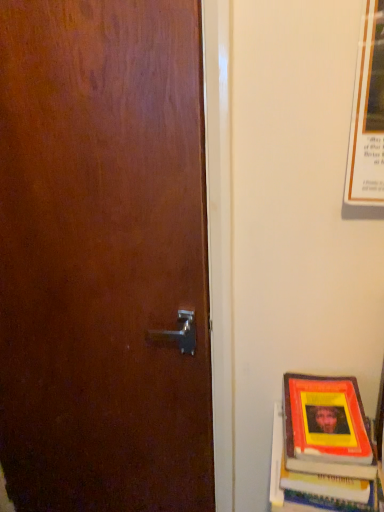
Question: Is matte paper poster at upper right spatially inside yellow matte book at lower right, or outside of it?

Choices:
 (A) inside
 (B) outside

Answer: (B)

Question: From a real-world perspective, is matte paper poster at upper right positioned above or below yellow matte book at lower right?

Choices:
 (A) below
 (B) above

Answer: (B)

Question: From the image's perspective, relative to yellow matte book at lower right, is matte paper poster at upper right above or below?

Choices:
 (A) above
 (B) below

Answer: (A)

Question: From the image's perspective, is yellow matte book at lower right positioned above or below matte paper poster at upper right?

Choices:
 (A) above
 (B) below

Answer: (B)

Question: Is yellow matte book at lower right spatially inside matte paper poster at upper right, or outside of it?

Choices:
 (A) outside
 (B) inside

Answer: (A)

Question: Based on their positions, is yellow matte book at lower right located to the left or right of matte paper poster at upper right?

Choices:
 (A) left
 (B) right

Answer: (A)

Question: From their relative heights in the image, would you say yellow matte book at lower right is taller or shorter than matte paper poster at upper right?

Choices:
 (A) short
 (B) tall

Answer: (A)